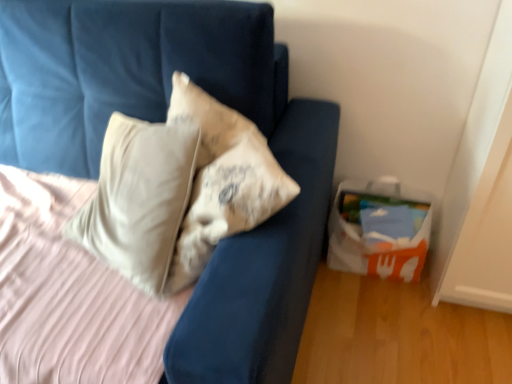
Question: From a real-world perspective, relative to velvet blue sofa at upper left, is white paper bag at lower right vertically above or below?

Choices:
 (A) below
 (B) above

Answer: (A)

Question: Does point (334, 218) appear closer or farther from the camera than point (303, 206)?

Choices:
 (A) farther
 (B) closer

Answer: (A)

Question: From the image's perspective, relative to velvet blue sofa at upper left, is white paper bag at lower right above or below?

Choices:
 (A) below
 (B) above

Answer: (A)

Question: Is velvet blue sofa at upper left spatially inside white paper bag at lower right, or outside of it?

Choices:
 (A) outside
 (B) inside

Answer: (A)

Question: From a real-world perspective, is velvet blue sofa at upper left physically located above or below white paper bag at lower right?

Choices:
 (A) below
 (B) above

Answer: (B)

Question: In terms of size, does velvet blue sofa at upper left appear bigger or smaller than white paper bag at lower right?

Choices:
 (A) big
 (B) small

Answer: (A)

Question: From their relative heights in the image, would you say velvet blue sofa at upper left is taller or shorter than white paper bag at lower right?

Choices:
 (A) short
 (B) tall

Answer: (B)